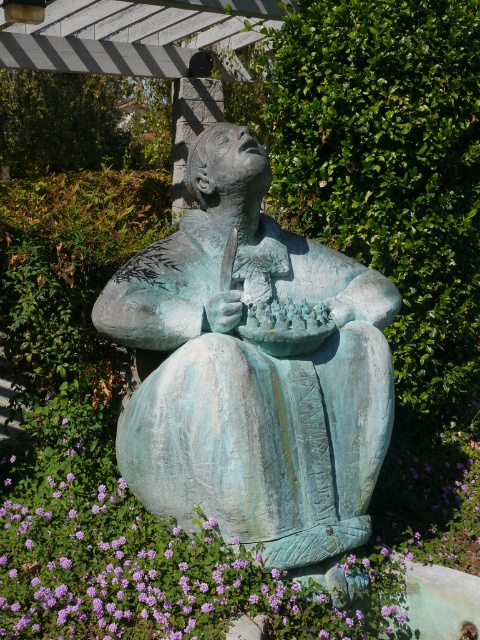
You are a gardener who wants to place a new decorative item between the green patina statue at center and the purple matte flower at lower left. Considering their heights, which object should you use as a reference point to ensure the new item is proportionate?

The green patina statue at center is taller than the purple matte flower at lower left. To ensure proportionality, the gardener should use the green patina statue at center as the reference point for the new item.